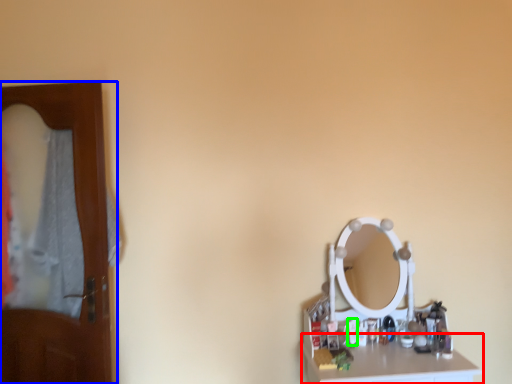
Question: Estimate the real-world distances between objects in this image. Which object is farther from counter top (highlighted by a red box), door (highlighted by a blue box) or toiletry (highlighted by a green box)?

Choices:
 (A) door
 (B) toiletry

Answer: (A)